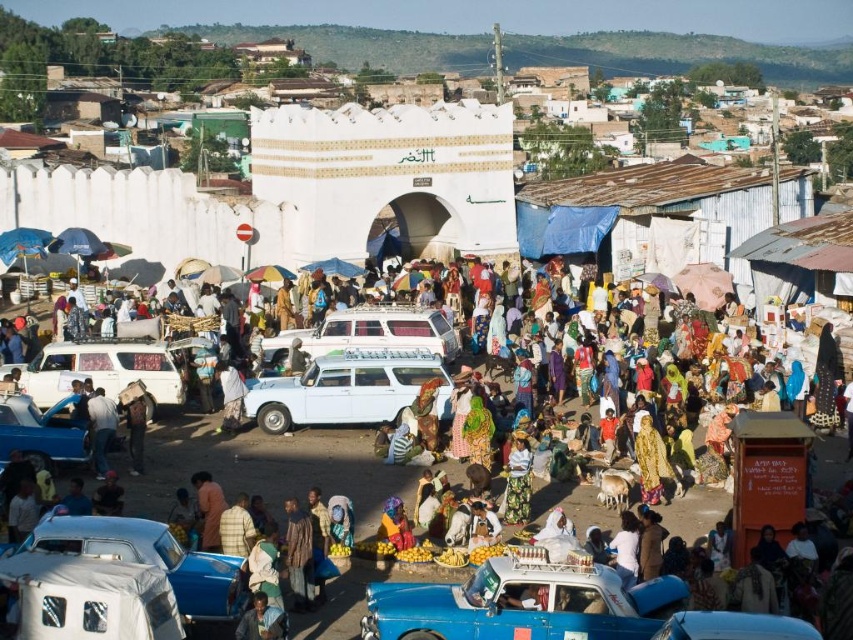
You are standing at the entrance of the market and want to locate the blue metallic car at lower center. According to the coordinates provided, in which direction should you look to find it?

The blue metallic car at lower center is located at coordinates point (555,608), so you should look towards the lower right direction to find it.